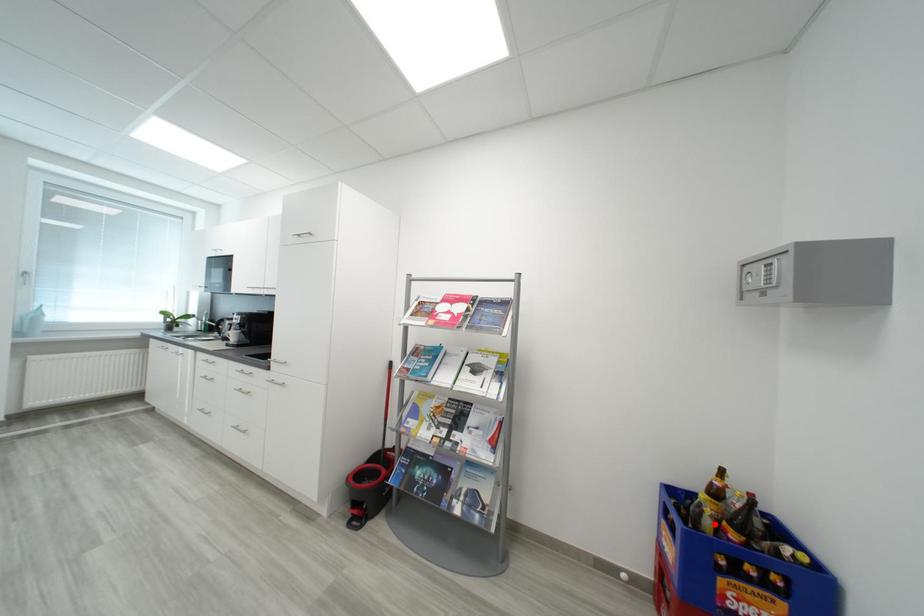
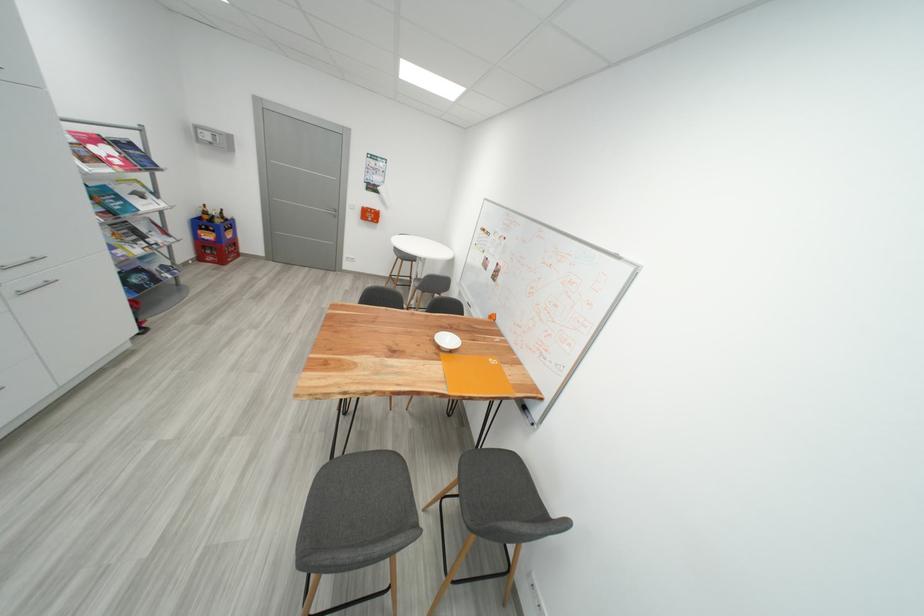
Question: I am providing you with two images of the same scene from different viewpoints. A red point is shown in image1. For the corresponding object point in image2, is it positioned nearer or farther from the camera?

Choices:
 (A) Nearer
 (B) Farther

Answer: (A)